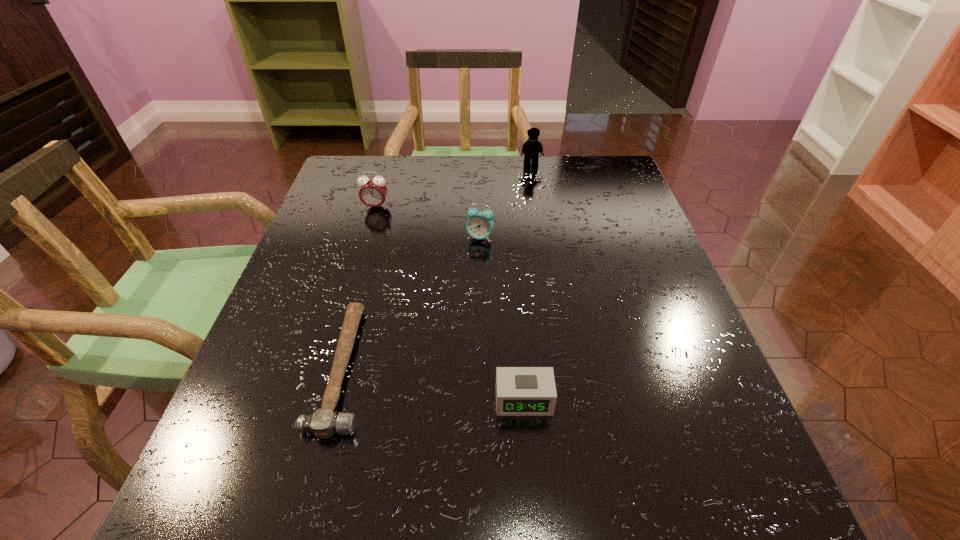
You are a GUI agent. You are given a task and a screenshot of the screen. Output one action in this format:
    pyautogui.click(x=<x>, y=<y>)
    Task: Click on the Lego
    
    Given the screenshot: What is the action you would take?
    pyautogui.click(x=532, y=147)

Find the location of a particular element. This screenshot has width=960, height=540. the farthest alarm clock is located at coordinates (373, 191).

Find the location of a particular element. This screenshot has width=960, height=540. the leftmost alarm clock is located at coordinates (373, 191).

Identify the location of the second farthest alarm clock. (479, 225).

Find the location of a particular element. the shortest alarm clock is located at coordinates (520, 391).

In order to click on the nearest alarm clock in this screenshot , I will do `click(520, 391)`.

Identify the location of hammer. The image size is (960, 540). (323, 423).

Locate an element on the screen. vacant region located 0.380m on the front-facing side of the farthest object is located at coordinates (546, 260).

Where is `free region located 0.210m on the clock face of the fourth nearest object`? This screenshot has height=540, width=960. free region located 0.210m on the clock face of the fourth nearest object is located at coordinates (358, 268).

Locate an element on the screen. free region located 0.330m on the face of the third nearest object is located at coordinates (480, 364).